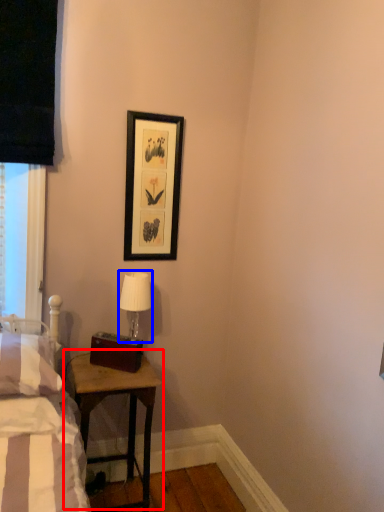
Question: Which of the following is the farthest to the observer, table (highlighted by a red box) or table lamp (highlighted by a blue box)?

Choices:
 (A) table
 (B) table lamp

Answer: (B)